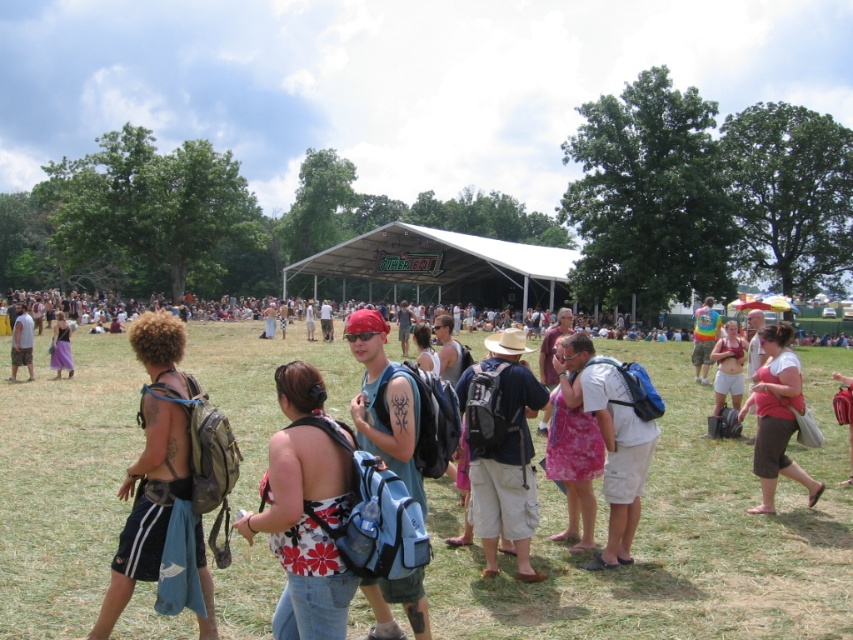
Between matte blue backpack at center and skinny white tank top at center, which one has less height?

skinny white tank top at center

You are a GUI agent. You are given a task and a screenshot of the screen. Output one action in this format:
    pyautogui.click(x=<x>, y=<y>)
    Task: Click on the matte blue backpack at center
    This screenshot has height=640, width=853.
    Given the screenshot: What is the action you would take?
    pyautogui.click(x=384, y=401)

Where is `matte blue backpack at center`? The width and height of the screenshot is (853, 640). matte blue backpack at center is located at coordinates (384, 401).

Between pink fabric dress at center and matte black backpack at center, which one appears on the right side from the viewer's perspective?

Positioned to the right is pink fabric dress at center.

Find the location of a particular element. pink fabric dress at center is located at coordinates (613, 444).

I want to click on pink fabric dress at center, so coord(613,444).

Does pink fabric dress at lower right lie behind skinny white tank top at center?

That is False.

Which is above, pink fabric dress at lower right or skinny white tank top at center?

skinny white tank top at center

Identify the location of pink fabric dress at lower right. The width and height of the screenshot is (853, 640). click(x=776, y=417).